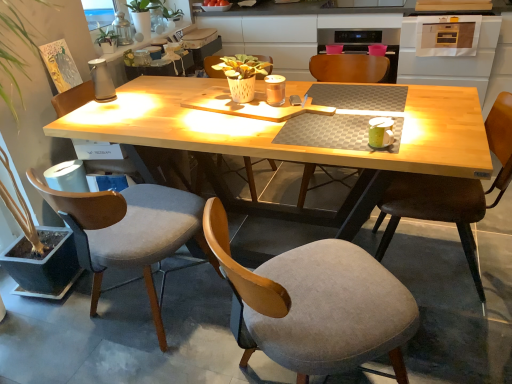
Question: Considering the relative positions of velvet grey chair at left, which appears as the 5th chair when viewed from the right, and gray fabric chair at left, which is the 1th chair in left-to-right order, in the image provided, is velvet grey chair at left, which appears as the 5th chair when viewed from the right, to the right of gray fabric chair at left, which is the 1th chair in left-to-right order, from the viewer's perspective?

Choices:
 (A) yes
 (B) no

Answer: (A)

Question: Is velvet grey chair at left, which appears as the 5th chair when viewed from the right, facing away from gray fabric chair at left, the 6th chair from the right?

Choices:
 (A) no
 (B) yes

Answer: (A)

Question: From a real-world perspective, is velvet grey chair at left, which is the 2th chair in left-to-right order, positioned over gray fabric chair at left, which is the 1th chair in left-to-right order, based on gravity?

Choices:
 (A) yes
 (B) no

Answer: (B)

Question: From the image's perspective, is velvet grey chair at left, which appears as the 5th chair when viewed from the right, below gray fabric chair at left, the 6th chair from the right?

Choices:
 (A) yes
 (B) no

Answer: (A)

Question: Can you confirm if velvet grey chair at left, which appears as the 5th chair when viewed from the right, is smaller than gray fabric chair at left, the 6th chair from the right?

Choices:
 (A) no
 (B) yes

Answer: (B)

Question: From the image's perspective, is velvet grey chair at left, which appears as the 5th chair when viewed from the right, over gray fabric chair at left, the 6th chair from the right?

Choices:
 (A) no
 (B) yes

Answer: (A)

Question: Can you confirm if matte wooden chair at center, the 2th chair from the right, is positioned to the left of wooden chair at center, marked as the 4th chair in a right-to-left arrangement?

Choices:
 (A) yes
 (B) no

Answer: (B)

Question: Does matte wooden chair at center, which is the 5th chair from left to right, lie behind wooden chair at center, the third chair when ordered from left to right?

Choices:
 (A) yes
 (B) no

Answer: (B)

Question: From a real-world perspective, is matte wooden chair at center, the 2th chair from the right, positioned over wooden chair at center, the third chair when ordered from left to right, based on gravity?

Choices:
 (A) no
 (B) yes

Answer: (A)

Question: Considering the relative sizes of matte wooden chair at center, which is the 5th chair from left to right, and wooden chair at center, the third chair when ordered from left to right, in the image provided, is matte wooden chair at center, which is the 5th chair from left to right, shorter than wooden chair at center, the third chair when ordered from left to right,?

Choices:
 (A) no
 (B) yes

Answer: (B)

Question: From the image's perspective, is matte wooden chair at center, the 2th chair from the right, beneath wooden chair at center, marked as the 4th chair in a right-to-left arrangement?

Choices:
 (A) yes
 (B) no

Answer: (A)

Question: Does matte wooden chair at center, which is the 5th chair from left to right, have a smaller size compared to wooden chair at center, marked as the 4th chair in a right-to-left arrangement?

Choices:
 (A) no
 (B) yes

Answer: (A)

Question: Is gray fabric chair at lower center, the third chair when ordered from right to left, next to gray fabric chair at left, the 6th chair from the right?

Choices:
 (A) no
 (B) yes

Answer: (A)